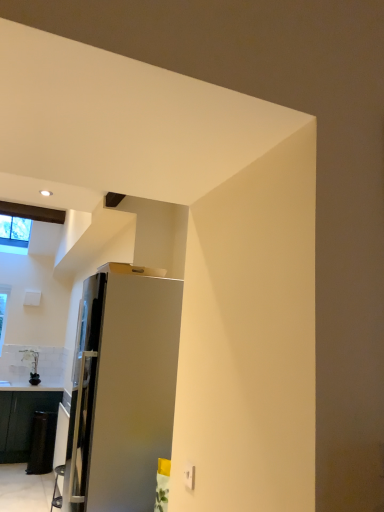
What do you see at coordinates (122, 390) in the screenshot?
I see `satin silver refrigerator at center` at bounding box center [122, 390].

This screenshot has height=512, width=384. I want to click on clear glass window at upper left, so click(15, 231).

Where is `satin silver refrigerator at center`? The image size is (384, 512). satin silver refrigerator at center is located at coordinates (122, 390).

Is clear glass window at upper left taller than black glossy cabinet at lower left?

No, clear glass window at upper left is not taller than black glossy cabinet at lower left.

Which is closer to the camera, [24,233] or [29,438]?

The point [29,438] is closer to the camera.

Would you say clear glass window at upper left is a long distance from black glossy cabinet at lower left?

That's right, there is a large distance between clear glass window at upper left and black glossy cabinet at lower left.

Can black glossy cabinet at lower left be found inside clear glass window at upper left?

Definitely not — black glossy cabinet at lower left is not inside clear glass window at upper left.

Which of these two, black glossy cabinet at lower left or satin silver refrigerator at center, is wider?

black glossy cabinet at lower left is wider.

What are the coordinates of `cabinetry below the satin silver refrigerator at center (from a real-world perspective)` in the screenshot? It's located at (22, 421).

From a real-world perspective, is black glossy cabinet at lower left positioned above or below satin silver refrigerator at center?

black glossy cabinet at lower left is situated lower than satin silver refrigerator at center in the real world.

Does black glossy cabinet at lower left turn towards satin silver refrigerator at center?

Yes, black glossy cabinet at lower left is oriented towards satin silver refrigerator at center.

Is black glossy cabinet at lower left touching clear glass window at upper left?

black glossy cabinet at lower left is not next to clear glass window at upper left, and they're not touching.

Who is shorter, black glossy cabinet at lower left or clear glass window at upper left?

clear glass window at upper left is shorter.

How far apart are black glossy cabinet at lower left and clear glass window at upper left?

2.33 meters.

Is black glossy cabinet at lower left oriented away from clear glass window at upper left?

black glossy cabinet at lower left is not turned away from clear glass window at upper left.

Considering the sizes of clear glass window at upper left and satin silver refrigerator at center in the image, is clear glass window at upper left taller or shorter than satin silver refrigerator at center?

In the image, clear glass window at upper left appears to be shorter than satin silver refrigerator at center.

You are a GUI agent. You are given a task and a screenshot of the screen. Output one action in this format:
    pyautogui.click(x=<x>, y=<y>)
    Task: Click on the refrigerator below the clear glass window at upper left (from a real-world perspective)
    The width and height of the screenshot is (384, 512).
    Given the screenshot: What is the action you would take?
    pyautogui.click(x=122, y=390)

Is clear glass window at upper left not near satin silver refrigerator at center?

Indeed, clear glass window at upper left is not near satin silver refrigerator at center.

Can we say clear glass window at upper left lies outside satin silver refrigerator at center?

That's correct, clear glass window at upper left is outside of satin silver refrigerator at center.

Is the depth of satin silver refrigerator at center less than that of clear glass window at upper left?

Yes, satin silver refrigerator at center is closer to the viewer.

From a real-world perspective, between satin silver refrigerator at center and clear glass window at upper left, who is vertically higher?

clear glass window at upper left, from a real-world perspective.

Which of these two, satin silver refrigerator at center or clear glass window at upper left, is wider?

clear glass window at upper left.

Is satin silver refrigerator at center facing away from clear glass window at upper left?

No.

Is there a large distance between satin silver refrigerator at center and black glossy cabinet at lower left?

Yes, satin silver refrigerator at center is far from black glossy cabinet at lower left.

Can you confirm if satin silver refrigerator at center is positioned to the right of black glossy cabinet at lower left?

Yes, satin silver refrigerator at center is to the right of black glossy cabinet at lower left.

Which of these two, satin silver refrigerator at center or black glossy cabinet at lower left, is wider?

black glossy cabinet at lower left.

From a real-world perspective, is satin silver refrigerator at center located beneath black glossy cabinet at lower left?

No.

At what (x,y) coordinates should I click in order to perform the action: click on cabinetry lying in front of the clear glass window at upper left. Please return your answer as a coordinate pair (x, y). Looking at the image, I should click on (22, 421).

At what (x,y) coordinates should I click in order to perform the action: click on cabinetry below the satin silver refrigerator at center (from the image's perspective). Please return your answer as a coordinate pair (x, y). The height and width of the screenshot is (512, 384). Looking at the image, I should click on (22, 421).

Looking at the image, which one is located closer to satin silver refrigerator at center, clear glass window at upper left or black glossy cabinet at lower left?

The object closer to satin silver refrigerator at center is black glossy cabinet at lower left.

Estimate the real-world distances between objects in this image. Which object is further from black glossy cabinet at lower left, clear glass window at upper left or satin silver refrigerator at center?

Among the two, satin silver refrigerator at center is located further to black glossy cabinet at lower left.

Estimate the real-world distances between objects in this image. Which object is closer to black glossy cabinet at lower left, satin silver refrigerator at center or clear glass window at upper left?

Based on the image, clear glass window at upper left appears to be nearer to black glossy cabinet at lower left.

Estimate the real-world distances between objects in this image. Which object is closer to clear glass window at upper left, satin silver refrigerator at center or black glossy cabinet at lower left?

black glossy cabinet at lower left is closer to clear glass window at upper left.

From the image, which object appears to be nearer to clear glass window at upper left, black glossy cabinet at lower left or satin silver refrigerator at center?

black glossy cabinet at lower left is positioned closer to the anchor clear glass window at upper left.

Considering their positions, is black glossy cabinet at lower left positioned closer to satin silver refrigerator at center than clear glass window at upper left?

Based on the image, black glossy cabinet at lower left appears to be nearer to satin silver refrigerator at center.

The width and height of the screenshot is (384, 512). I want to click on cabinetry between satin silver refrigerator at center and clear glass window at upper left along the z-axis, so click(22, 421).